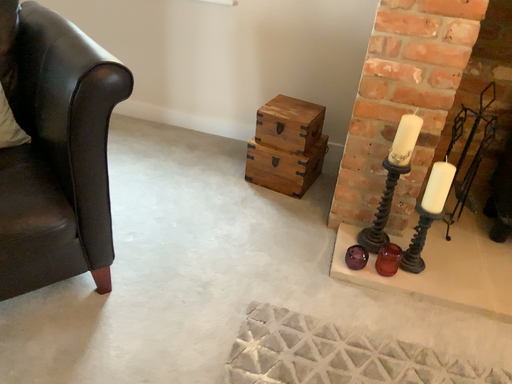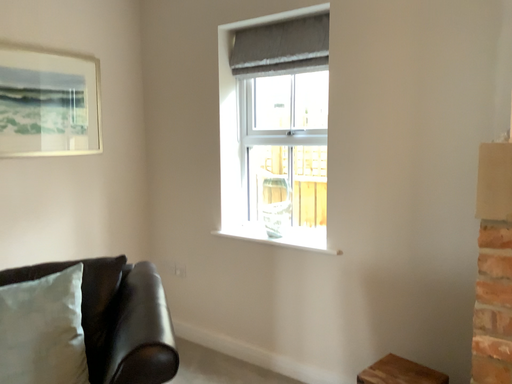
Question: How did the camera likely rotate when shooting the video?

Choices:
 (A) rotated left
 (B) rotated right

Answer: (A)